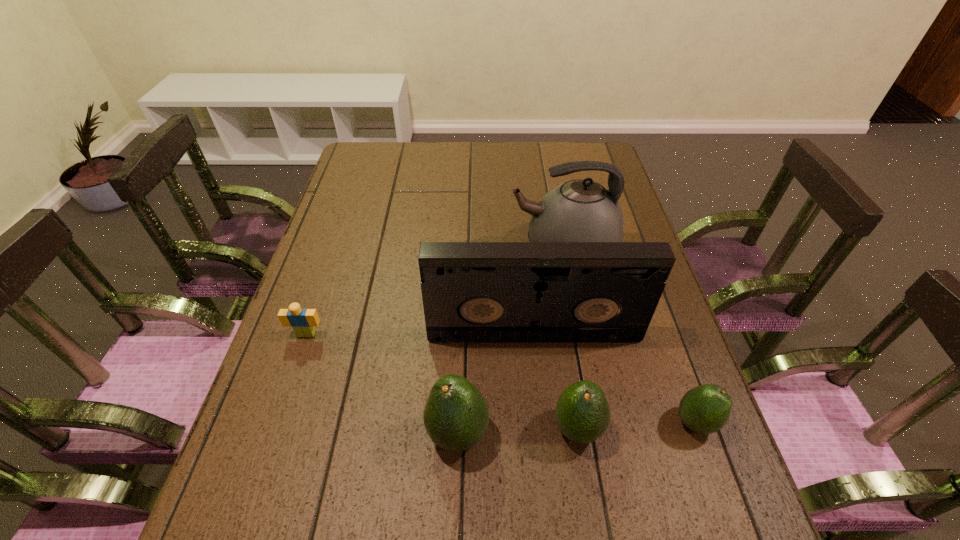
This screenshot has width=960, height=540. Find the location of `vacant area situated on the back of the second tallest avocado`. vacant area situated on the back of the second tallest avocado is located at coordinates (570, 383).

This screenshot has height=540, width=960. Find the location of `free space located on the left of the second shortest object`. free space located on the left of the second shortest object is located at coordinates (624, 422).

Locate an element on the screen. The width and height of the screenshot is (960, 540). free location located on the front side of the videotape is located at coordinates (541, 406).

In order to click on free space located at the spout of the farthest object in this screenshot , I will do `click(383, 246)`.

Locate an element on the screen. Image resolution: width=960 pixels, height=540 pixels. free space located 0.260m at the spout of the farthest object is located at coordinates (419, 246).

Where is `vacant space located at the spout of the farthest object`? vacant space located at the spout of the farthest object is located at coordinates (439, 246).

Find the location of a particular element. Image resolution: width=960 pixels, height=540 pixels. vacant space situated 0.190m on the face of the shortest object is located at coordinates (279, 414).

Where is `object present at the left edge`? object present at the left edge is located at coordinates (302, 321).

This screenshot has width=960, height=540. Identify the location of avocado that is positioned at the right edge. (705, 409).

I want to click on videotape present at the right edge, so click(x=473, y=292).